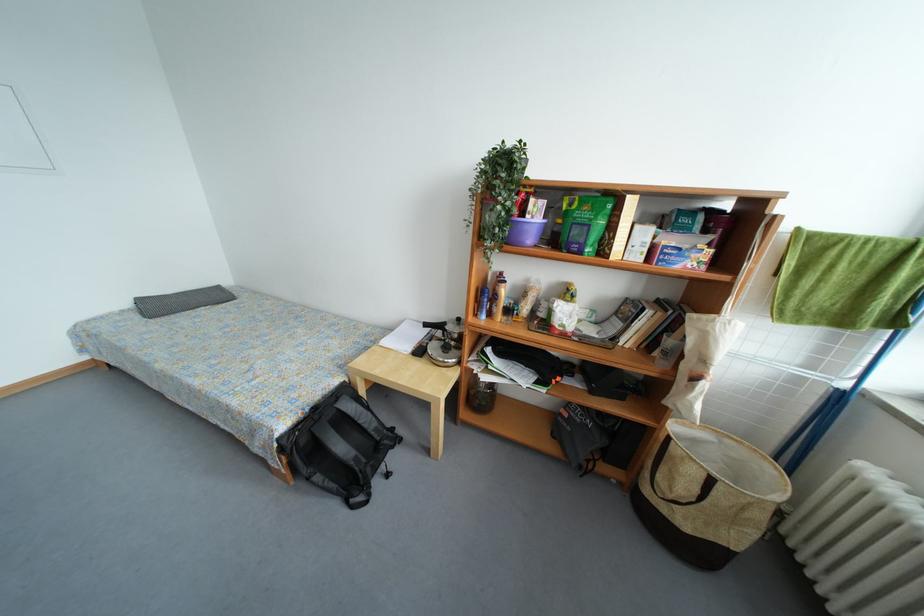
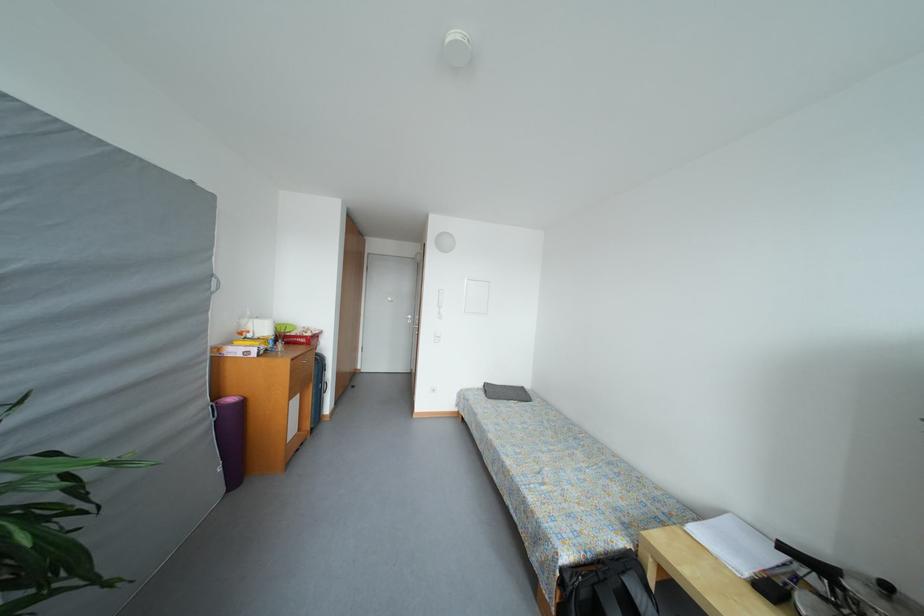
Locate, in the second image, the point that corresponds to [351,394] in the first image.

(638, 567)